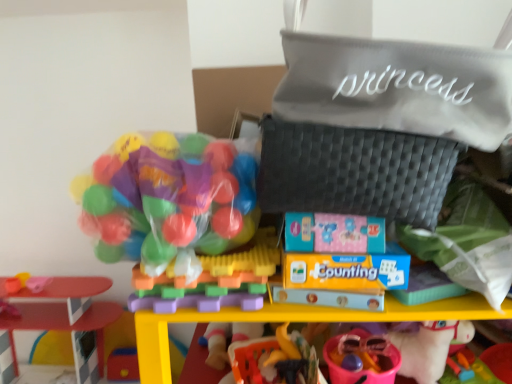
Question: From a real-world perspective, is smooth plastic table at left, acting as the fifth toy starting from the right, physically below translucent plastic balls at upper left, which ranks as the 2th toy in left-to-right order?

Choices:
 (A) yes
 (B) no

Answer: (A)

Question: Would you say translucent plastic balls at upper left, which ranks as the 2th toy in left-to-right order, is part of smooth plastic table at left, which is counted as the first toy, starting from the left,'s contents?

Choices:
 (A) yes
 (B) no

Answer: (B)

Question: From the image's perspective, is smooth plastic table at left, acting as the fifth toy starting from the right, beneath translucent plastic balls at upper left, which is the 4th toy in right-to-left order?

Choices:
 (A) no
 (B) yes

Answer: (B)

Question: From the image's perspective, is smooth plastic table at left, acting as the fifth toy starting from the right, over translucent plastic balls at upper left, which is the 4th toy in right-to-left order?

Choices:
 (A) no
 (B) yes

Answer: (A)

Question: Is smooth plastic table at left, acting as the fifth toy starting from the right, shorter than translucent plastic balls at upper left, which ranks as the 2th toy in left-to-right order?

Choices:
 (A) yes
 (B) no

Answer: (B)

Question: Is smooth plastic table at left, acting as the fifth toy starting from the right, bigger than translucent plastic balls at upper left, which ranks as the 2th toy in left-to-right order?

Choices:
 (A) yes
 (B) no

Answer: (A)

Question: Considering the relative sizes of pink plastic bucket at lower center, the 1th toy viewed from the right, and translucent plastic balls at upper left, which ranks as the 2th toy in left-to-right order, in the image provided, is pink plastic bucket at lower center, the 1th toy viewed from the right, smaller than translucent plastic balls at upper left, which ranks as the 2th toy in left-to-right order,?

Choices:
 (A) no
 (B) yes

Answer: (B)

Question: Is pink plastic bucket at lower center, the 1th toy viewed from the right, facing towards translucent plastic balls at upper left, which is the 4th toy in right-to-left order?

Choices:
 (A) yes
 (B) no

Answer: (B)

Question: Would you say translucent plastic balls at upper left, which ranks as the 2th toy in left-to-right order, is part of pink plastic bucket at lower center, the 5th toy viewed from the left,'s contents?

Choices:
 (A) no
 (B) yes

Answer: (A)

Question: From a real-world perspective, is pink plastic bucket at lower center, the 1th toy viewed from the right, positioned under translucent plastic balls at upper left, which is the 4th toy in right-to-left order, based on gravity?

Choices:
 (A) yes
 (B) no

Answer: (A)

Question: From the image's perspective, is pink plastic bucket at lower center, the 5th toy viewed from the left, below translucent plastic balls at upper left, which ranks as the 2th toy in left-to-right order?

Choices:
 (A) yes
 (B) no

Answer: (A)

Question: Is pink plastic bucket at lower center, the 5th toy viewed from the left, at the left side of translucent plastic balls at upper left, which ranks as the 2th toy in left-to-right order?

Choices:
 (A) yes
 (B) no

Answer: (B)

Question: Is smooth plastic table at left, which is counted as the first toy, starting from the left, in front of rubber duck at lower center, acting as the 4th toy starting from the left?

Choices:
 (A) yes
 (B) no

Answer: (B)